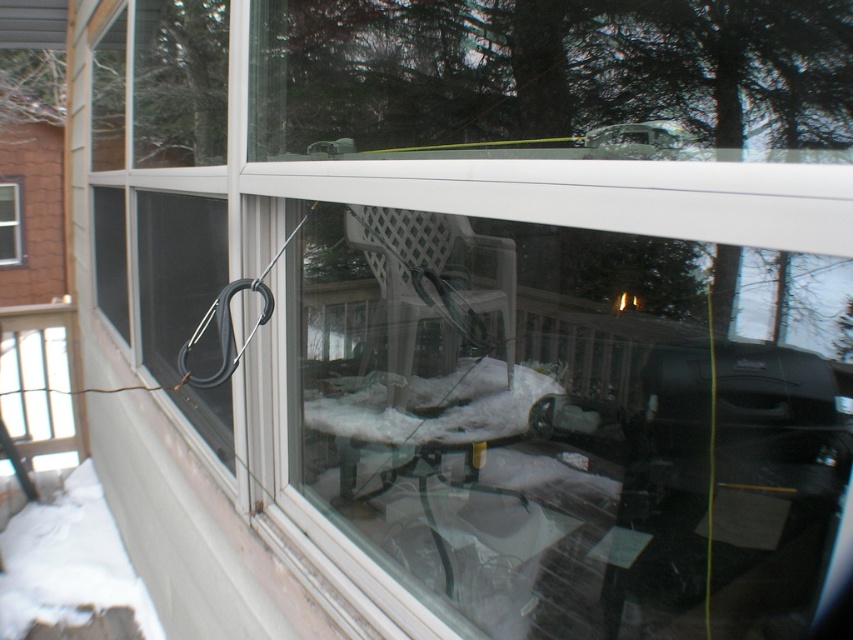
Question: Where is white powdery snow at lower left located in relation to clear glass window at upper left in the image?

Choices:
 (A) right
 (B) left

Answer: (A)

Question: Which point is closer to the camera?

Choices:
 (A) clear glass window at upper left
 (B) white plastic porch at lower left
 (C) white powdery snow at lower left

Answer: (C)

Question: Can you confirm if white powdery snow at lower left is positioned below white plastic porch at lower left?

Choices:
 (A) no
 (B) yes

Answer: (B)

Question: Estimate the real-world distances between objects in this image. Which object is closer to the clear glass window at upper left?

Choices:
 (A) white plastic porch at lower left
 (B) white powdery snow at lower left

Answer: (A)

Question: Can you confirm if white powdery snow at lower left is bigger than clear glass window at upper left?

Choices:
 (A) yes
 (B) no

Answer: (A)

Question: Which object is the closest to the white powdery snow at lower left?

Choices:
 (A) clear glass window at upper left
 (B) white plastic porch at lower left

Answer: (B)